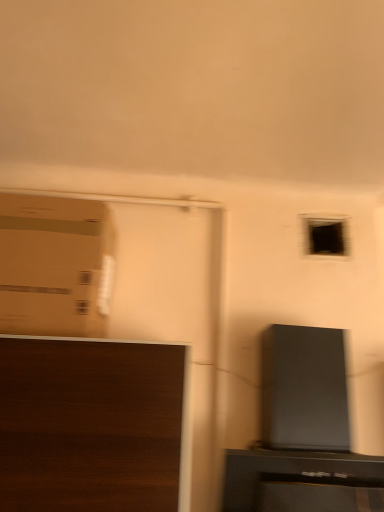
The image size is (384, 512). I want to click on cardboard box at left, so click(55, 266).

Measure the distance between cardboard box at left and camera.

cardboard box at left is 1.05 meters from camera.

Image resolution: width=384 pixels, height=512 pixels. Describe the element at coordinates (55, 266) in the screenshot. I see `cardboard box at left` at that location.

What do you see at coordinates (93, 426) in the screenshot?
I see `dark wood cabinet at lower left` at bounding box center [93, 426].

Measure the distance between dark wood cabinet at lower left and camera.

dark wood cabinet at lower left and camera are 35.18 inches apart.

The width and height of the screenshot is (384, 512). What are the coordinates of `dark wood cabinet at lower left` in the screenshot? It's located at (93, 426).

The image size is (384, 512). In order to click on cardboard box at left in this screenshot , I will do `click(55, 266)`.

Considering the relative positions of dark wood cabinet at lower left and cardboard box at left in the image provided, is dark wood cabinet at lower left to the left of cardboard box at left from the viewer's perspective?

No, dark wood cabinet at lower left is not to the left of cardboard box at left.

Is dark wood cabinet at lower left closer to camera compared to cardboard box at left?

Yes, dark wood cabinet at lower left is closer to the viewer.

Is point (12, 398) more distant than point (105, 265)?

That is False.

From the image's perspective, is dark wood cabinet at lower left located above or below cardboard box at left?

Clearly, from the image's perspective, dark wood cabinet at lower left is below cardboard box at left.

From a real-world perspective, is dark wood cabinet at lower left located beneath cardboard box at left?

Yes, from a real-world perspective, dark wood cabinet at lower left is beneath cardboard box at left.

Considering the relative sizes of dark wood cabinet at lower left and cardboard box at left in the image provided, is dark wood cabinet at lower left thinner than cardboard box at left?

No.

Does dark wood cabinet at lower left have a lesser height compared to cardboard box at left?

Incorrect, the height of dark wood cabinet at lower left does not fall short of that of cardboard box at left.

Looking at the image, does dark wood cabinet at lower left seem bigger or smaller compared to cardboard box at left?

dark wood cabinet at lower left is bigger than cardboard box at left.

Would you say dark wood cabinet at lower left contains cardboard box at left?

No, dark wood cabinet at lower left does not contain cardboard box at left.

Is dark wood cabinet at lower left not near cardboard box at left?

No, dark wood cabinet at lower left is in close proximity to cardboard box at left.

Is dark wood cabinet at lower left turned away from cardboard box at left?

No, dark wood cabinet at lower left's orientation is not away from cardboard box at left.

At what (x,y) coordinates should I click in order to perform the action: click on cardboard box above the dark wood cabinet at lower left (from the image's perspective). Please return your answer as a coordinate pair (x, y). The height and width of the screenshot is (512, 384). Looking at the image, I should click on (55, 266).

In the image, is cardboard box at left on the left side or the right side of dark wood cabinet at lower left?

Based on their positions, cardboard box at left is located to the left of dark wood cabinet at lower left.

Does cardboard box at left lie behind dark wood cabinet at lower left?

Yes, cardboard box at left is further from the camera.

Which point is more forward, (1,322) or (11,395)?

The point (11,395) is in front.

From the image's perspective, is cardboard box at left over dark wood cabinet at lower left?

Indeed, from the image's perspective, cardboard box at left is shown above dark wood cabinet at lower left.

From a real-world perspective, is cardboard box at left on dark wood cabinet at lower left?

Yes, from a real-world perspective, cardboard box at left is over dark wood cabinet at lower left

Considering the sizes of objects cardboard box at left and dark wood cabinet at lower left in the image provided, who is thinner, cardboard box at left or dark wood cabinet at lower left?

cardboard box at left.

Does cardboard box at left have a greater height compared to dark wood cabinet at lower left?

No, cardboard box at left is not taller than dark wood cabinet at lower left.

Can you confirm if cardboard box at left is bigger than dark wood cabinet at lower left?

No, cardboard box at left is not bigger than dark wood cabinet at lower left.

Can dark wood cabinet at lower left be found inside cardboard box at left?

That's incorrect, dark wood cabinet at lower left is not inside cardboard box at left.

Is cardboard box at left far from dark wood cabinet at lower left?

No, there isn't a large distance between cardboard box at left and dark wood cabinet at lower left.

Is cardboard box at left oriented towards dark wood cabinet at lower left?

No, cardboard box at left is not facing towards dark wood cabinet at lower left.

Find the location of a particular element. cardboard box above the dark wood cabinet at lower left (from a real-world perspective) is located at coordinates (55, 266).

In order to click on cardboard box located behind the dark wood cabinet at lower left in this screenshot , I will do `click(55, 266)`.

You are a GUI agent. You are given a task and a screenshot of the screen. Output one action in this format:
    pyautogui.click(x=<x>, y=<y>)
    Task: Click on the cardboard box located above the dark wood cabinet at lower left (from the image's perspective)
    
    Given the screenshot: What is the action you would take?
    pyautogui.click(x=55, y=266)